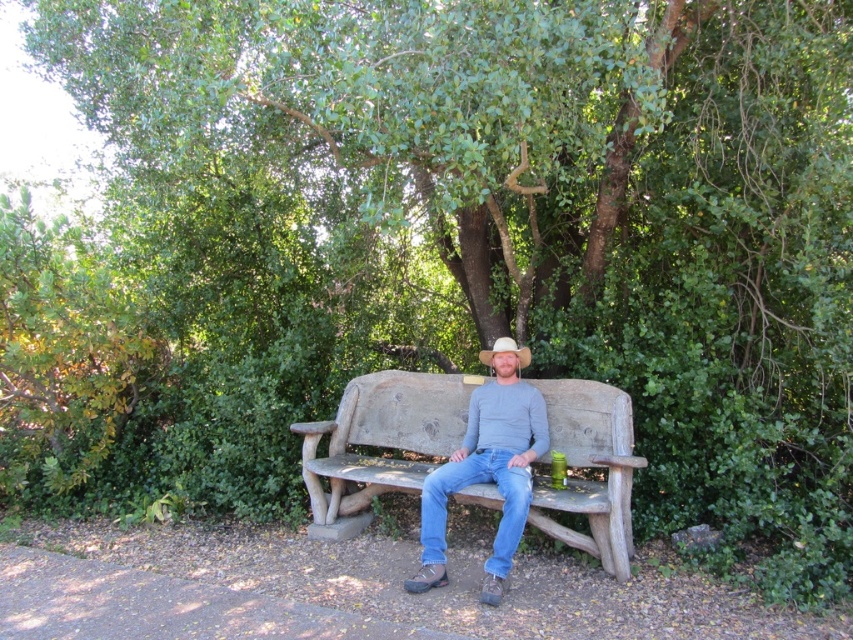
Question: Estimate the real-world distances between objects in this image. Which object is farther from the white matte cowboy hat at center?

Choices:
 (A) rustic wood bench at center
 (B) matte gray shirt at center

Answer: (A)

Question: Is rustic wood bench at center to the left of matte gray shirt at center from the viewer's perspective?

Choices:
 (A) no
 (B) yes

Answer: (B)

Question: Does rustic wood bench at center have a lesser width compared to matte gray shirt at center?

Choices:
 (A) yes
 (B) no

Answer: (B)

Question: Is rustic wood bench at center thinner than white matte cowboy hat at center?

Choices:
 (A) yes
 (B) no

Answer: (B)

Question: Which of these objects is positioned farthest from the matte gray shirt at center?

Choices:
 (A) rustic wood bench at center
 (B) white matte cowboy hat at center

Answer: (B)

Question: Which point is closer to the camera?

Choices:
 (A) (509, 340)
 (B) (602, 493)
 (C) (515, 484)

Answer: (C)